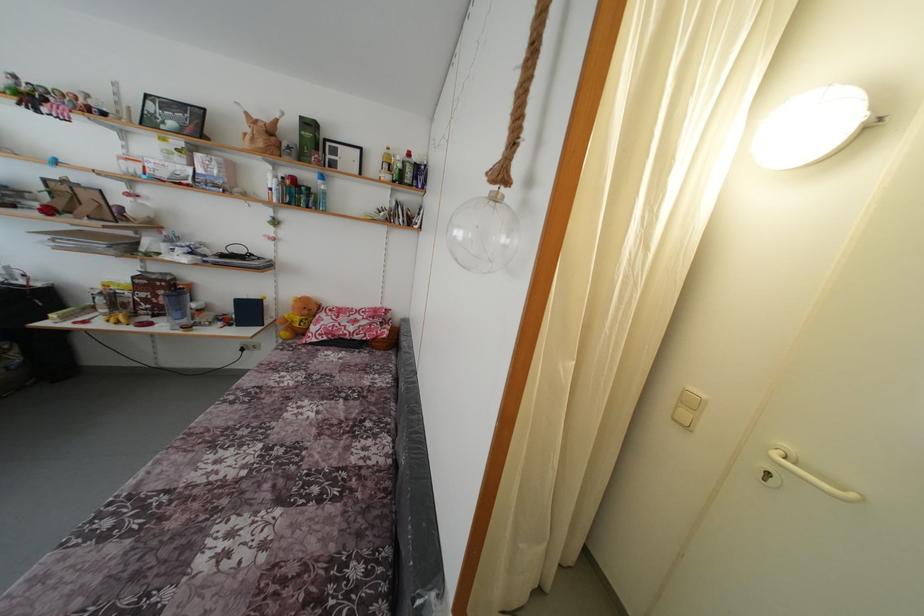
Find where to lift the glass ball ornament. Please return your answer as a coordinate pair (x, y).

(482, 233)